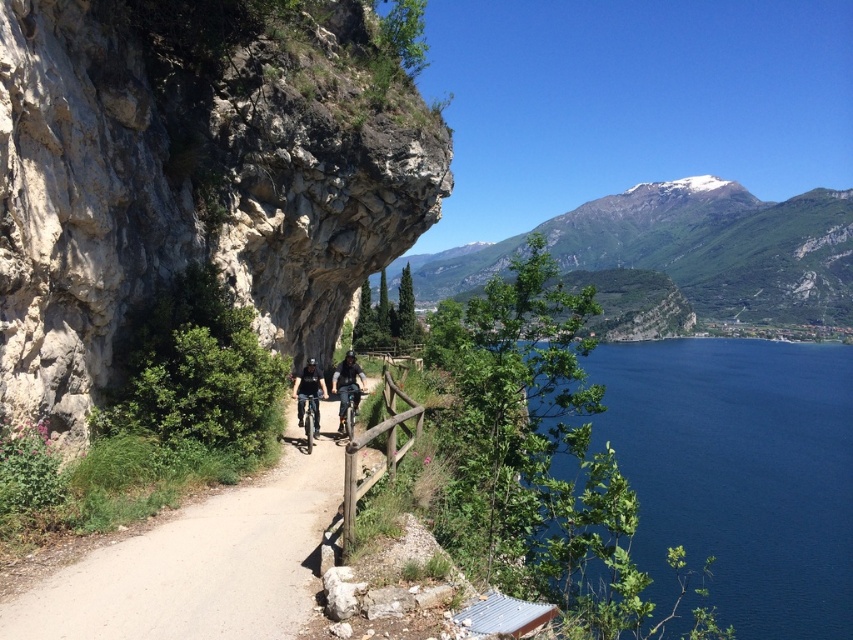
You are a cyclist standing on the cliff path and want to get a closer look at the deep blue water at lower right. If you move forward 10 meters, will you be able to see it better?

The deep blue water at lower right is 26.94 meters away from the viewer. Moving forward 10 meters would bring you to 16.94 meters away, so yes, you will be able to see it better as you are closer.

You are standing at the cliff edge near the cyclists and want to reach a point marked at coordinates point (796,627). Given that the wooden railing is 10 feet away from the cliff edge, can you safely walk towards that point without crossing the railing?

The distance between point (796,627) and the viewer is 206.66 feet. Since the wooden railing is only 10 feet away from the cliff edge, you can safely walk towards the point as long as you stay behind the railing. However, the total distance to the point is much greater than the 10 feet, so you would need to navigate the path carefully while maintaining a safe distance from the cliff edge.